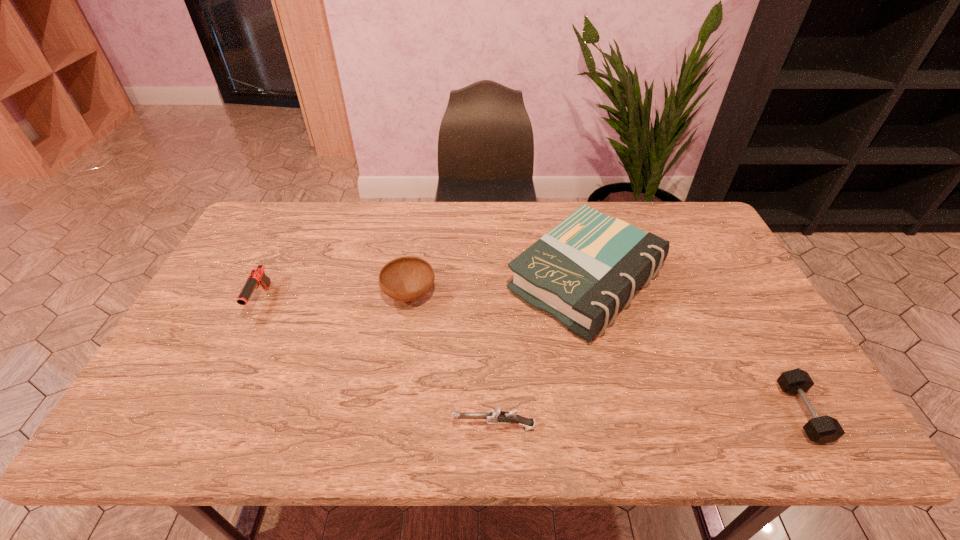
At what (x,y) coordinates should I click in order to perform the action: click on paperback book. Please return your answer as a coordinate pair (x, y). The width and height of the screenshot is (960, 540). Looking at the image, I should click on (583, 271).

Identify the location of the farther gun. (257, 277).

Find the location of a particular element. Image resolution: width=960 pixels, height=540 pixels. the left gun is located at coordinates (257, 277).

Find the location of a particular element. This screenshot has width=960, height=540. the fourth object from right to left is located at coordinates (409, 278).

This screenshot has height=540, width=960. I want to click on the shorter gun, so click(x=496, y=416).

This screenshot has width=960, height=540. What are the coordinates of `the nearer gun` in the screenshot? It's located at (496, 416).

Find the location of a particular element. Image resolution: width=960 pixels, height=540 pixels. the shortest object is located at coordinates (825, 429).

Find the location of a particular element. This screenshot has width=960, height=540. dumbbell is located at coordinates (825, 429).

The height and width of the screenshot is (540, 960). Find the location of `vacant space located 0.170m on the back of the tallest object`. vacant space located 0.170m on the back of the tallest object is located at coordinates (566, 201).

I want to click on vacant space located 0.320m at the aiming end of the farther gun, so click(198, 430).